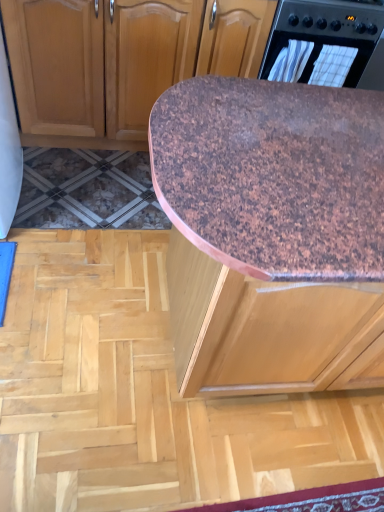
Question: Are brown speckled granite countertop at center and brown speckled plywood at center far apart?

Choices:
 (A) no
 (B) yes

Answer: (A)

Question: Does brown speckled granite countertop at center lie in front of brown speckled plywood at center?

Choices:
 (A) no
 (B) yes

Answer: (B)

Question: Is brown speckled granite countertop at center facing towards brown speckled plywood at center?

Choices:
 (A) no
 (B) yes

Answer: (A)

Question: Is brown speckled granite countertop at center shorter than brown speckled plywood at center?

Choices:
 (A) yes
 (B) no

Answer: (B)

Question: From a real-world perspective, is brown speckled granite countertop at center physically above brown speckled plywood at center?

Choices:
 (A) yes
 (B) no

Answer: (A)

Question: Considering their positions, is brown speckled granite countertop at center located in front of or behind black plastic oven at upper right?

Choices:
 (A) behind
 (B) front

Answer: (B)

Question: From a real-world perspective, relative to black plastic oven at upper right, is brown speckled granite countertop at center vertically above or below?

Choices:
 (A) below
 (B) above

Answer: (A)

Question: Considering the positions of point (354, 238) and point (299, 74), is point (354, 238) closer or farther from the camera than point (299, 74)?

Choices:
 (A) closer
 (B) farther

Answer: (A)

Question: In the image, is brown speckled granite countertop at center on the left side or the right side of black plastic oven at upper right?

Choices:
 (A) left
 (B) right

Answer: (A)

Question: Considering the positions of point (316, 26) and point (185, 173), is point (316, 26) closer or farther from the camera than point (185, 173)?

Choices:
 (A) farther
 (B) closer

Answer: (A)

Question: From the image's perspective, relative to brown speckled granite countertop at center, is black plastic oven at upper right above or below?

Choices:
 (A) above
 (B) below

Answer: (A)

Question: Is black plastic oven at upper right spatially inside brown speckled granite countertop at center, or outside of it?

Choices:
 (A) outside
 (B) inside

Answer: (A)

Question: In terms of width, does black plastic oven at upper right look wider or thinner when compared to brown speckled granite countertop at center?

Choices:
 (A) thin
 (B) wide

Answer: (A)

Question: Visually, is black plastic oven at upper right positioned to the left or to the right of brown speckled plywood at center?

Choices:
 (A) left
 (B) right

Answer: (B)

Question: In terms of size, does black plastic oven at upper right appear bigger or smaller than brown speckled plywood at center?

Choices:
 (A) big
 (B) small

Answer: (B)